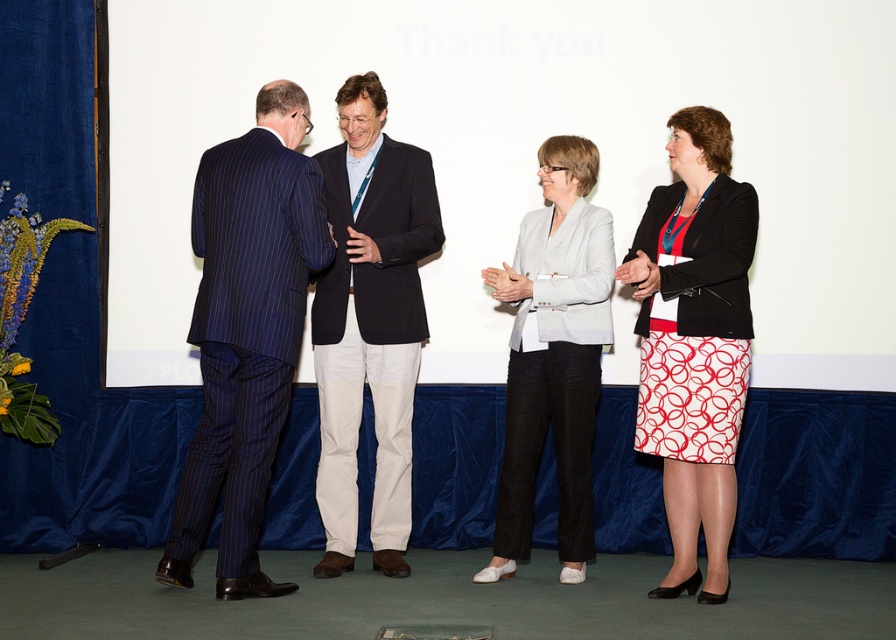
Question: Among these objects, which one is nearest to the camera?

Choices:
 (A) dark blue pinstripe suit at center
 (B) white matte screen at upper center
 (C) white printed skirt at center
 (D) light gray blazer at center

Answer: (C)

Question: Based on their relative distances, which object is farther from the light gray blazer at center?

Choices:
 (A) dark blue pinstripe suit at left
 (B) white matte screen at upper center
 (C) dark blue pinstripe suit at center
 (D) white printed skirt at center

Answer: (A)

Question: Considering the relative positions of white matte screen at upper center and light gray blazer at center in the image provided, where is white matte screen at upper center located with respect to light gray blazer at center?

Choices:
 (A) right
 (B) left

Answer: (B)

Question: Estimate the real-world distances between objects in this image. Which object is closer to the dark blue pinstripe suit at center?

Choices:
 (A) white printed skirt at center
 (B) white matte screen at upper center
 (C) dark blue pinstripe suit at left

Answer: (C)

Question: Does dark blue pinstripe suit at left appear under light gray blazer at center?

Choices:
 (A) no
 (B) yes

Answer: (A)

Question: Is white matte screen at upper center in front of light gray blazer at center?

Choices:
 (A) no
 (B) yes

Answer: (A)